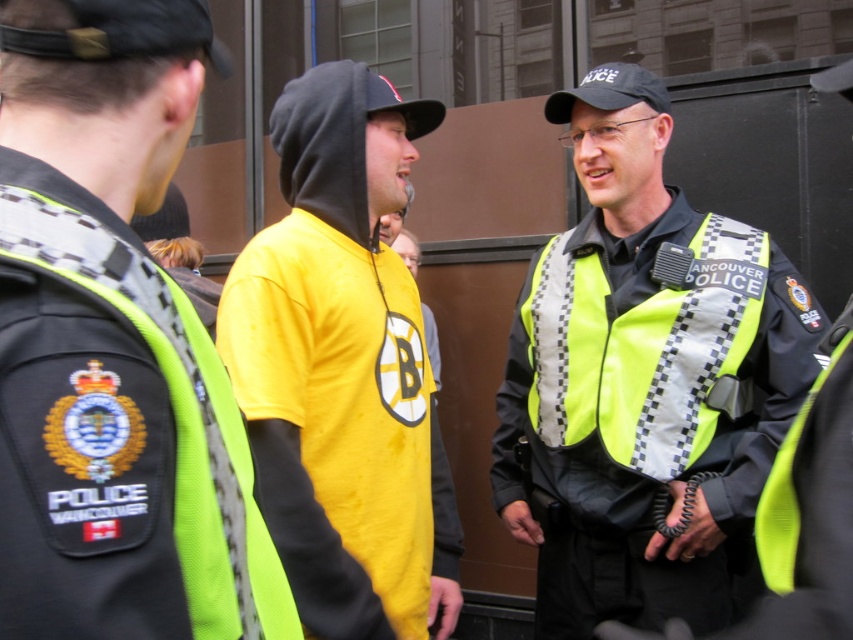
Can you confirm if yellow fabric shirt at center is bigger than neon yellow reflective vest at center?

Yes, yellow fabric shirt at center is bigger than neon yellow reflective vest at center.

Does point (376, 572) lie behind point (553, 445)?

No.

I want to click on yellow fabric shirt at center, so click(343, 368).

Locate an element on the screen. The width and height of the screenshot is (853, 640). yellow fabric shirt at center is located at coordinates (343, 368).

Can you confirm if reflective yellow vest at center is positioned above neon green fabric vest at center?

Yes.

Does point (548, 365) lie in front of point (109, 609)?

No.

The image size is (853, 640). What do you see at coordinates (643, 381) in the screenshot?
I see `reflective yellow vest at center` at bounding box center [643, 381].

Find the location of a particular element. reflective yellow vest at center is located at coordinates (643, 381).

Does neon green fabric vest at center have a greater width compared to neon yellow reflective vest at center?

No, neon green fabric vest at center is not wider than neon yellow reflective vest at center.

Is neon green fabric vest at center to the left of neon yellow reflective vest at center from the viewer's perspective?

Indeed, neon green fabric vest at center is positioned on the left side of neon yellow reflective vest at center.

The width and height of the screenshot is (853, 640). Describe the element at coordinates (111, 444) in the screenshot. I see `neon green fabric vest at center` at that location.

The width and height of the screenshot is (853, 640). Find the location of `neon green fabric vest at center`. neon green fabric vest at center is located at coordinates (111, 444).